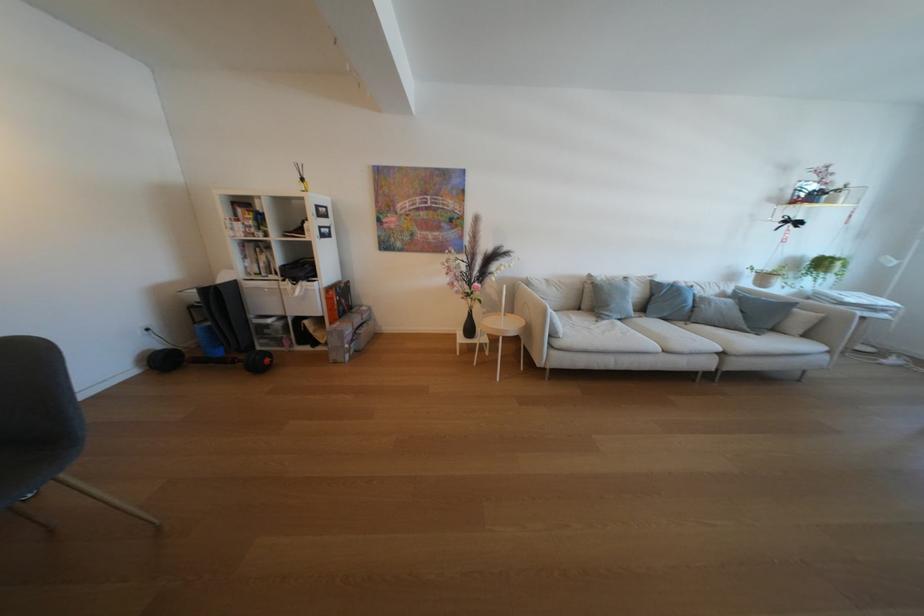
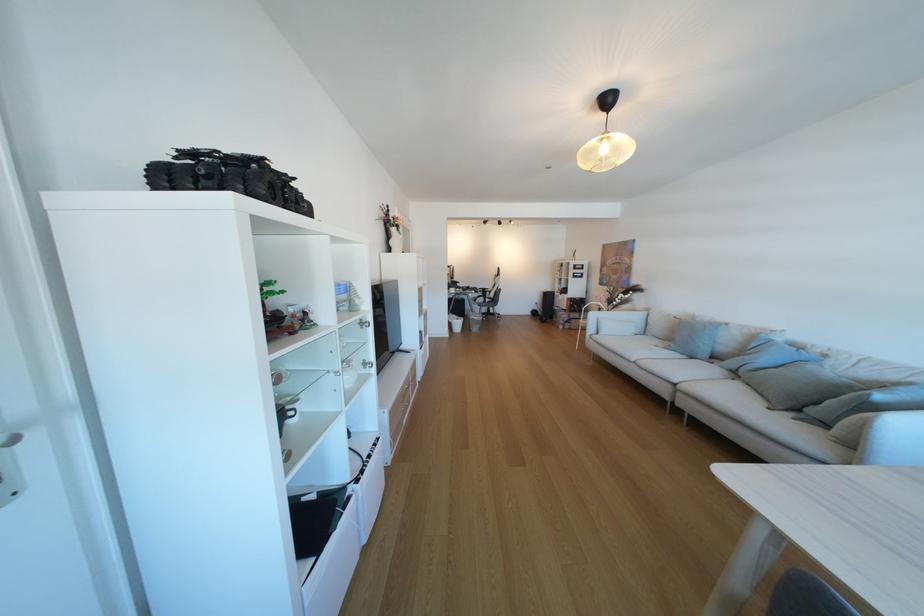
Find the pixel in the second image that matches point 358,310 in the first image.

(589, 310)